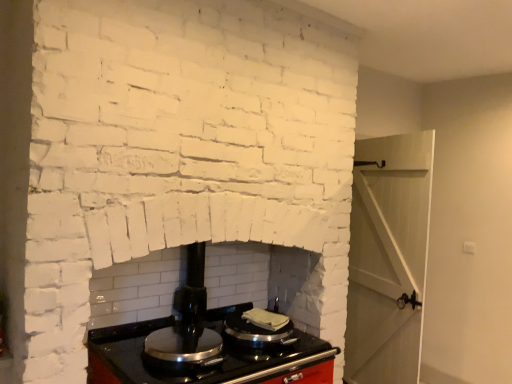
Question: Is metallic silver stove top at center taller than shiny black stove top at center?

Choices:
 (A) yes
 (B) no

Answer: (A)

Question: From a real-world perspective, does metallic silver stove top at center stand above shiny black stove top at center?

Choices:
 (A) yes
 (B) no

Answer: (A)

Question: Considering the relative positions of metallic silver stove top at center and shiny black stove top at center in the image provided, is metallic silver stove top at center to the right of shiny black stove top at center from the viewer's perspective?

Choices:
 (A) no
 (B) yes

Answer: (B)

Question: Can you confirm if metallic silver stove top at center is positioned to the left of shiny black stove top at center?

Choices:
 (A) no
 (B) yes

Answer: (A)

Question: From the image's perspective, is metallic silver stove top at center under shiny black stove top at center?

Choices:
 (A) no
 (B) yes

Answer: (A)

Question: Is metallic silver stove top at center not inside shiny black stove top at center?

Choices:
 (A) no
 (B) yes

Answer: (B)

Question: From a real-world perspective, is shiny black stove top at center located beneath metallic silver stove top at center?

Choices:
 (A) no
 (B) yes

Answer: (B)

Question: Does shiny black stove top at center have a lesser height compared to metallic silver stove top at center?

Choices:
 (A) no
 (B) yes

Answer: (B)

Question: Can you confirm if shiny black stove top at center is thinner than metallic silver stove top at center?

Choices:
 (A) yes
 (B) no

Answer: (A)

Question: Can you confirm if shiny black stove top at center is taller than metallic silver stove top at center?

Choices:
 (A) no
 (B) yes

Answer: (A)

Question: Does shiny black stove top at center have a smaller size compared to metallic silver stove top at center?

Choices:
 (A) no
 (B) yes

Answer: (B)

Question: From the image's perspective, does shiny black stove top at center appear higher than metallic silver stove top at center?

Choices:
 (A) no
 (B) yes

Answer: (A)

Question: In the image, is metallic silver stove top at center positioned in front of or behind shiny black stove top at center?

Choices:
 (A) front
 (B) behind

Answer: (B)